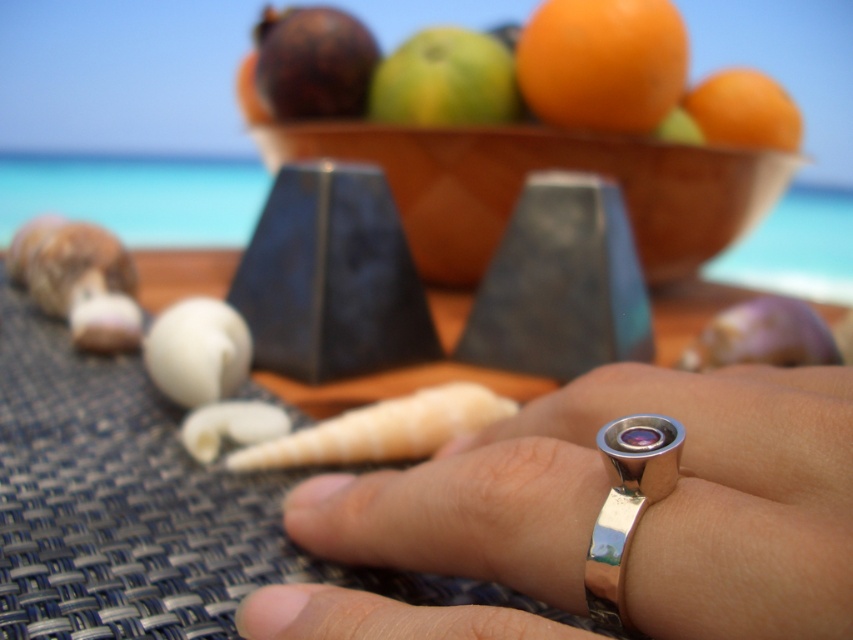
Between point (294, 88) and point (645, 467), which one is positioned behind?

The point (294, 88) is more distant.

Based on the photo, who is shorter, shiny brown coconut at upper center or polished silver ring at center?

polished silver ring at center

Which is behind, point (283, 42) or point (604, 516)?

Positioned behind is point (283, 42).

Locate an element on the screen. shiny brown coconut at upper center is located at coordinates (312, 61).

Looking at this image, measure the distance from orangesmoothfruit at upper center to orangesmoothfruit at right.

orangesmoothfruit at upper center is 7.13 inches away from orangesmoothfruit at right.

Is orangesmoothfruit at upper center wider than orangesmoothfruit at right?

Yes, orangesmoothfruit at upper center is wider than orangesmoothfruit at right.

Is point (637, 1) closer to camera compared to point (708, 81)?

Yes, it is.

The height and width of the screenshot is (640, 853). Identify the location of orangesmoothfruit at upper center. (602, 61).

Is polished silver ring at center smaller than orangesmoothfruit at right?

Correct, polished silver ring at center occupies less space than orangesmoothfruit at right.

Is the position of polished silver ring at center more distant than that of orangesmoothfruit at right?

No, it is not.

Between point (662, 445) and point (717, 132), which one is positioned behind?

The point (717, 132) is behind.

At what (x,y) coordinates should I click in order to perform the action: click on polished silver ring at center. Please return your answer as a coordinate pair (x, y). The height and width of the screenshot is (640, 853). Looking at the image, I should click on (625, 506).